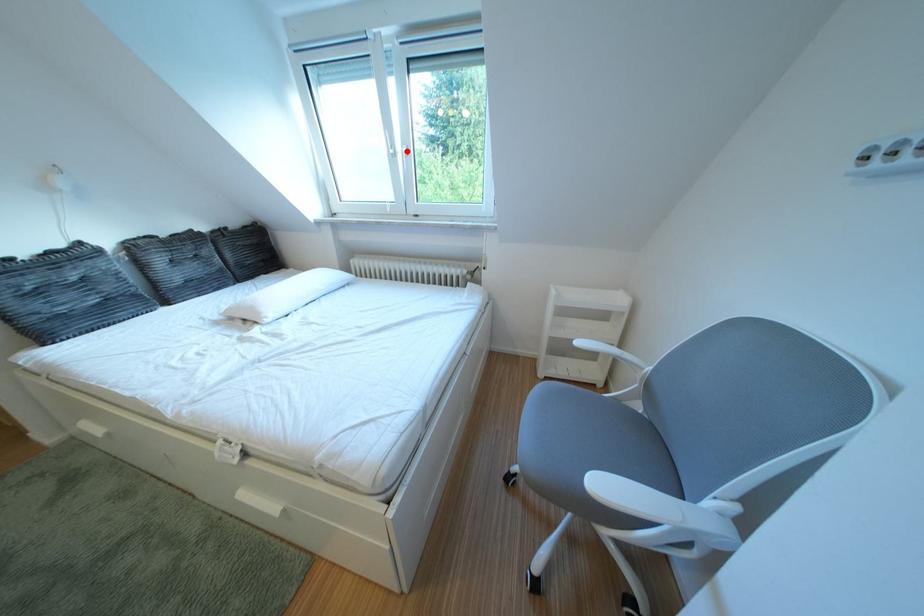
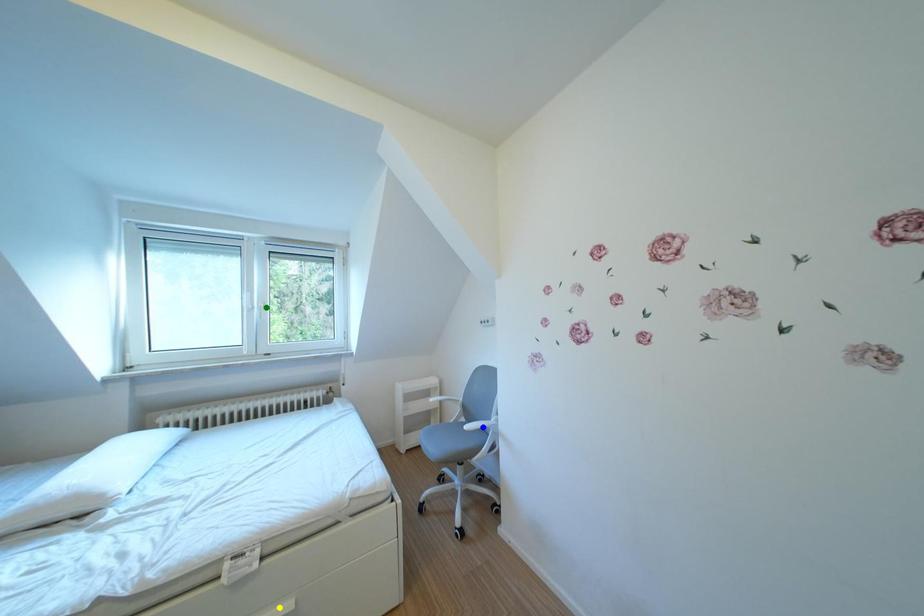
Question: I am providing you with two images of the same scene from different viewpoints. A red point is marked on the first image. You are given multiple points on the second image. In image 2, which mark is for the same physical point as the one in image 1?

Choices:
 (A) green point
 (B) blue point
 (C) yellow point

Answer: (A)